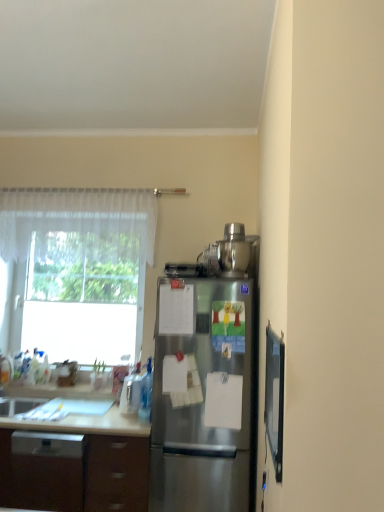
Question: From the image's perspective, is transparent glass window at left below stainless steel refrigerator at center?

Choices:
 (A) no
 (B) yes

Answer: (A)

Question: From the image's perspective, is transparent glass window at left located above stainless steel refrigerator at center?

Choices:
 (A) no
 (B) yes

Answer: (B)

Question: Considering the relative positions of transparent glass window at left and stainless steel refrigerator at center in the image provided, is transparent glass window at left behind stainless steel refrigerator at center?

Choices:
 (A) no
 (B) yes

Answer: (B)

Question: Can you confirm if transparent glass window at left is wider than stainless steel refrigerator at center?

Choices:
 (A) no
 (B) yes

Answer: (B)

Question: Is transparent glass window at left bigger than stainless steel refrigerator at center?

Choices:
 (A) no
 (B) yes

Answer: (A)

Question: Can you confirm if transparent glass window at left is positioned to the left of stainless steel refrigerator at center?

Choices:
 (A) no
 (B) yes

Answer: (B)

Question: Is stainless steel refrigerator at center next to brown wood cabinet at lower left and touching it?

Choices:
 (A) yes
 (B) no

Answer: (B)

Question: Considering the relative sizes of stainless steel refrigerator at center and brown wood cabinet at lower left in the image provided, is stainless steel refrigerator at center bigger than brown wood cabinet at lower left?

Choices:
 (A) no
 (B) yes

Answer: (A)

Question: From the image's perspective, is stainless steel refrigerator at center below brown wood cabinet at lower left?

Choices:
 (A) yes
 (B) no

Answer: (B)

Question: Is stainless steel refrigerator at center behind brown wood cabinet at lower left?

Choices:
 (A) no
 (B) yes

Answer: (B)

Question: Is stainless steel refrigerator at center at the left side of brown wood cabinet at lower left?

Choices:
 (A) yes
 (B) no

Answer: (B)

Question: Is brown wood cabinet at lower left a part of stainless steel refrigerator at center?

Choices:
 (A) no
 (B) yes

Answer: (A)

Question: Can you confirm if brown wood cabinet at lower left is positioned to the right of sheer white curtain at upper left?

Choices:
 (A) no
 (B) yes

Answer: (A)